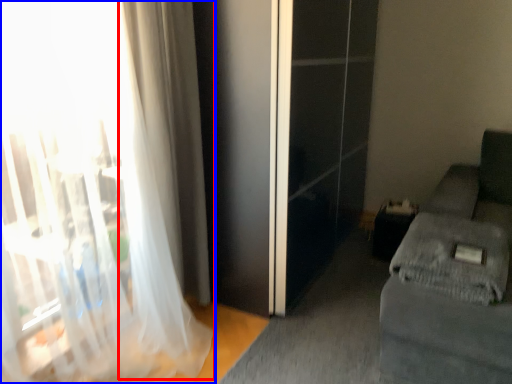
Question: Which of the following is the farthest to the observer, curtain (highlighted by a red box) or curtain (highlighted by a blue box)?

Choices:
 (A) curtain
 (B) curtain

Answer: (A)